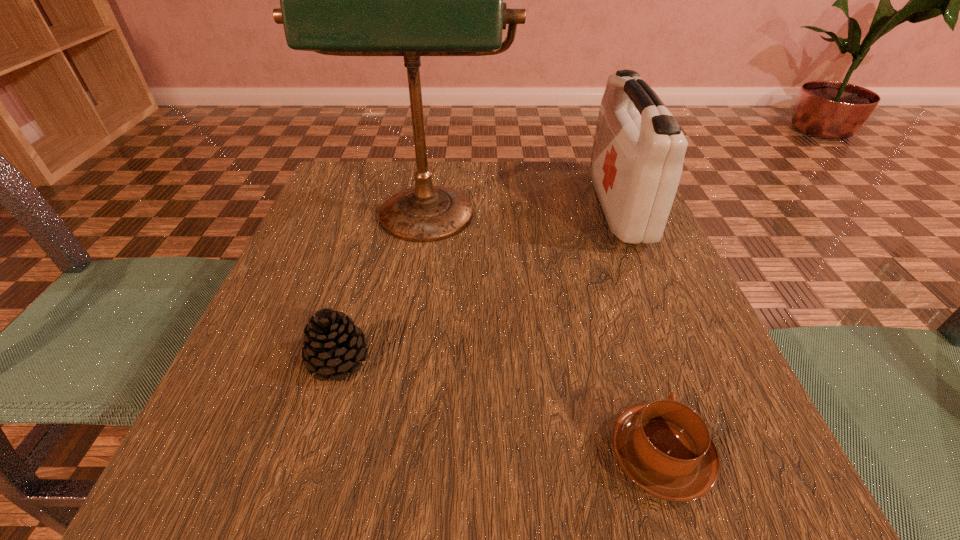
Identify which object is the closest to the cappuccino. Please provide its 2D coordinates. Your answer should be formatted as a tuple, i.e. [(x, y)], where the tuple contains the x and y coordinates of a point satisfying the conditions above.

[(411, 0)]

The image size is (960, 540). Identify the location of the second closest object to the second nearest object. (664, 447).

The height and width of the screenshot is (540, 960). I want to click on vacant point that satisfies the following two spatial constraints: 1. at the narrow end of the pinecone; 2. on the side of the cappuccino with the handle, so click(311, 455).

The height and width of the screenshot is (540, 960). Identify the location of vacant space that satisfies the following two spatial constraints: 1. above the green lampshade of the table lamp; 2. at the narrow end of the pinecone. click(403, 360).

This screenshot has width=960, height=540. I want to click on vacant region that satisfies the following two spatial constraints: 1. above the green lampshade of the tallest object; 2. at the narrow end of the second shortest object, so click(x=403, y=360).

At what (x,y) coordinates should I click in order to perform the action: click on vacant position in the image that satisfies the following two spatial constraints: 1. above the green lampshade of the tallest object; 2. at the narrow end of the second nearest object. Please return your answer as a coordinate pair (x, y). This screenshot has width=960, height=540. Looking at the image, I should click on (403, 360).

Image resolution: width=960 pixels, height=540 pixels. I want to click on free space that satisfies the following two spatial constraints: 1. at the narrow end of the third farthest object; 2. on the side of the nearest object with the handle, so click(311, 455).

The image size is (960, 540). Identify the location of free spot that satisfies the following two spatial constraints: 1. on the front side of the second tallest object; 2. above the green lampshade of the table lamp. (625, 223).

I want to click on vacant space that satisfies the following two spatial constraints: 1. at the narrow end of the third tallest object; 2. on the side of the nearest object with the handle, so click(311, 455).

Find the location of a particular element. This screenshot has width=960, height=540. vacant space that satisfies the following two spatial constraints: 1. on the side of the nearest object with the handle; 2. at the narrow end of the pinecone is located at coordinates (631, 360).